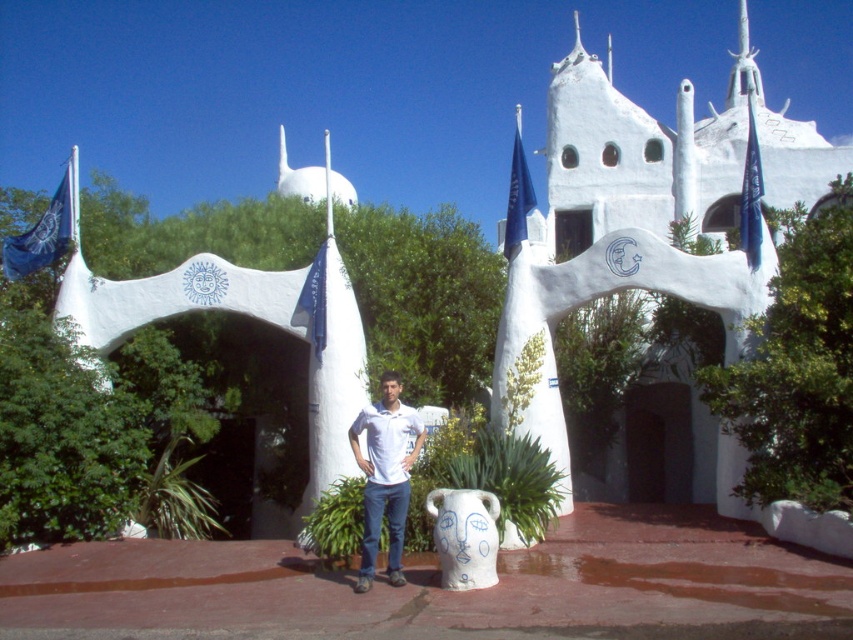
You are standing in front of the arches and want to take a photo of the white stucco church at center. If your camera has a maximum zoom range of 50 meters, will you be able to capture the church clearly in your photo?

The white stucco church at center is 44.78 meters away from the viewer. Since the camera can zoom up to 50 meters, it is within the range, so yes, you can capture the church clearly.

You are a drone operator tasked with capturing aerial footage of the white stucco church at center and the blue fabric flag at upper left. The minimum distance required for clear footage is 70 meters between the drone and the subject. Can the drone capture both subjects in a single shot without violating this distance requirement?

The white stucco church at center is 81.53 meters from the blue fabric flag at upper left. Since the minimum distance required is 70 meters, the drone can capture both subjects in a single shot as the distance between them meets the requirement.

You are a photographer standing at the base of the arches. You want to take a photo that includes both the blue fabric flag at upper center and the blue fabric flag at center. Given that your camera has a maximum focus range of 50 meters, will you be able to capture both flags in focus without moving your position?

The blue fabric flag at upper center is 51.32 meters away from the blue fabric flag at center. Since the distance between them exceeds the camera maximum focus range of 50 meters, you cannot capture both flags in focus without moving your position.